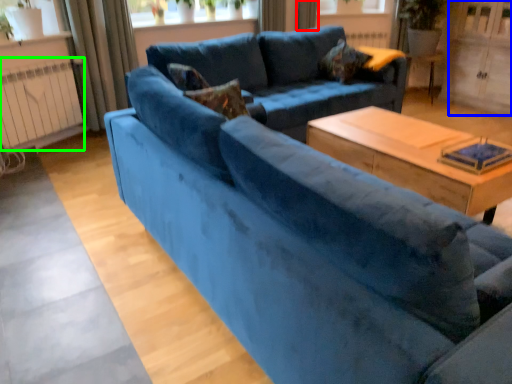
Question: Estimate the real-world distances between objects in this image. Which object is closer to curtain (highlighted by a red box), screen door (highlighted by a blue box) or radiator (highlighted by a green box)?

Choices:
 (A) screen door
 (B) radiator

Answer: (A)